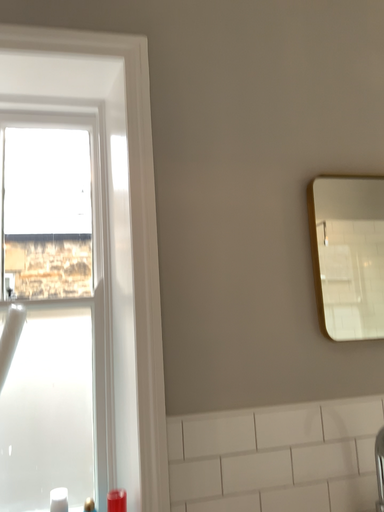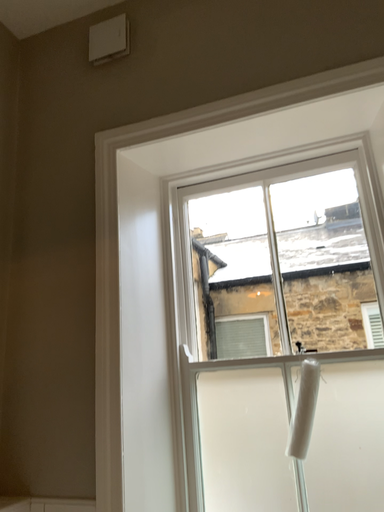
Question: Which way did the camera rotate in the video?

Choices:
 (A) rotated right
 (B) rotated left

Answer: (B)